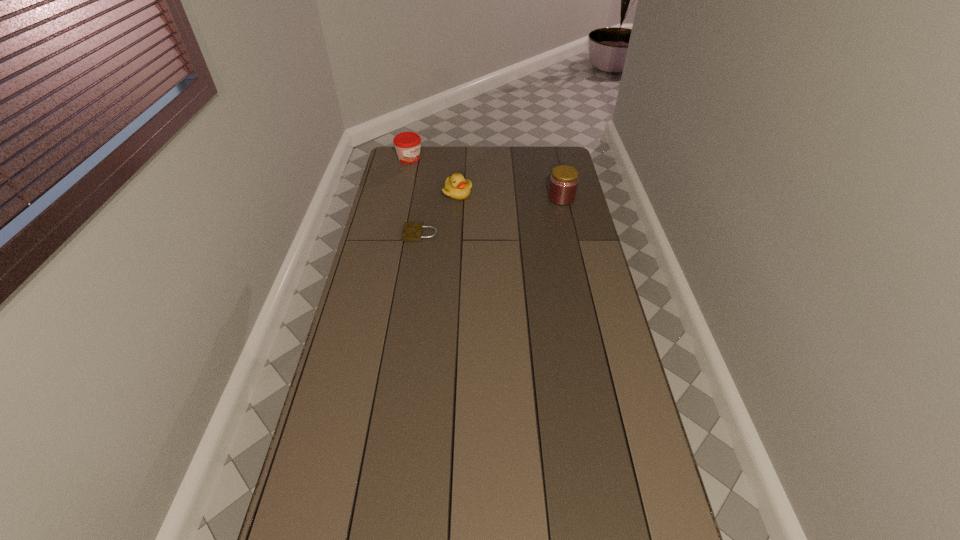
Locate an element on the screen. The image size is (960, 540). the shortest object is located at coordinates (412, 231).

Image resolution: width=960 pixels, height=540 pixels. I want to click on the nearest object, so click(412, 231).

Find the location of a particular element. Image resolution: width=960 pixels, height=540 pixels. the tallest object is located at coordinates (563, 184).

Where is `the nearer jam`? The height and width of the screenshot is (540, 960). the nearer jam is located at coordinates (563, 184).

Locate an element on the screen. The image size is (960, 540). the third object from left to right is located at coordinates (456, 187).

Locate an element on the screen. the shorter jam is located at coordinates (407, 144).

You are a GUI agent. You are given a task and a screenshot of the screen. Output one action in this format:
    pyautogui.click(x=<x>, y=<y>)
    Task: Click on the farthest object
    
    Given the screenshot: What is the action you would take?
    coord(407,144)

Where is `free point located on the keyhole side of the padlock`? This screenshot has width=960, height=540. free point located on the keyhole side of the padlock is located at coordinates (375, 234).

You are a GUI agent. You are given a task and a screenshot of the screen. Output one action in this format:
    pyautogui.click(x=<x>, y=<y>)
    Task: Click on the blank space located on the front of the nearer jam
    
    Given the screenshot: What is the action you would take?
    pyautogui.click(x=570, y=235)

Find the location of `free location located on the front-facing side of the second object from right to left`. free location located on the front-facing side of the second object from right to left is located at coordinates (545, 227).